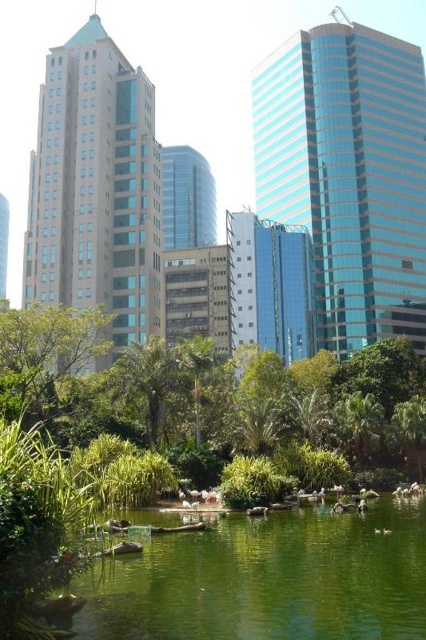
Question: Can you confirm if blue glassy tower at upper right is positioned to the left of matte glass building at left?

Choices:
 (A) yes
 (B) no

Answer: (B)

Question: Estimate the real-world distances between objects in this image. Which object is farther from the green glossy lake at center?

Choices:
 (A) green leafy tree at lower center
 (B) beige glass tower at left

Answer: (B)

Question: Which of the following is the farthest from the observer?

Choices:
 (A) shiny glass tower at center
 (B) green glossy lake at center
 (C) matte glass building at left

Answer: (A)

Question: Which point is farther to the camera?

Choices:
 (A) (327, 152)
 (B) (108, 611)
 (C) (345, 371)
 (D) (204, 218)

Answer: (D)

Question: Can you confirm if green leafy tree at lower center is positioned below matte glass building at left?

Choices:
 (A) yes
 (B) no

Answer: (A)

Question: Is green leafy tree at lower center thinner than matte glass building at left?

Choices:
 (A) yes
 (B) no

Answer: (A)